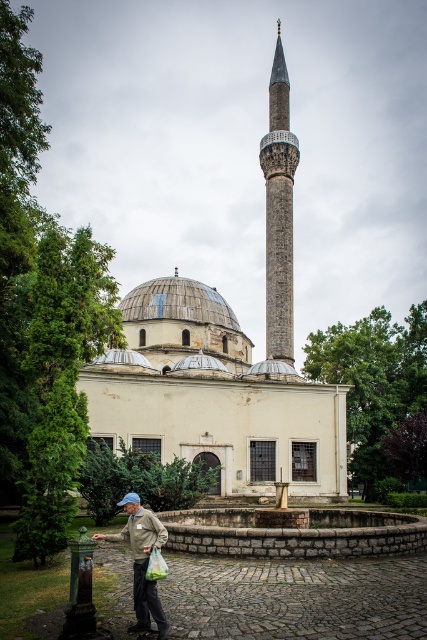
You are standing at the entrance of the historical mosque and want to take a photo of the gray stone minaret at center. The entrance is located at point 0.0, 0.0. Which direction should you face to capture the minaret in your shot?

The gray stone minaret at center is located at point (278, 211), which is to the northeast of the entrance at (0, 0). Therefore, you should face northeast to capture the minaret in your photo.

You are standing at the center of the mosque courtyard. Looking towards the minaret, you notice a specific point marked at coordinates (278, 211). What object is located at this point?

The gray stone minaret at center is located at point (278, 211).